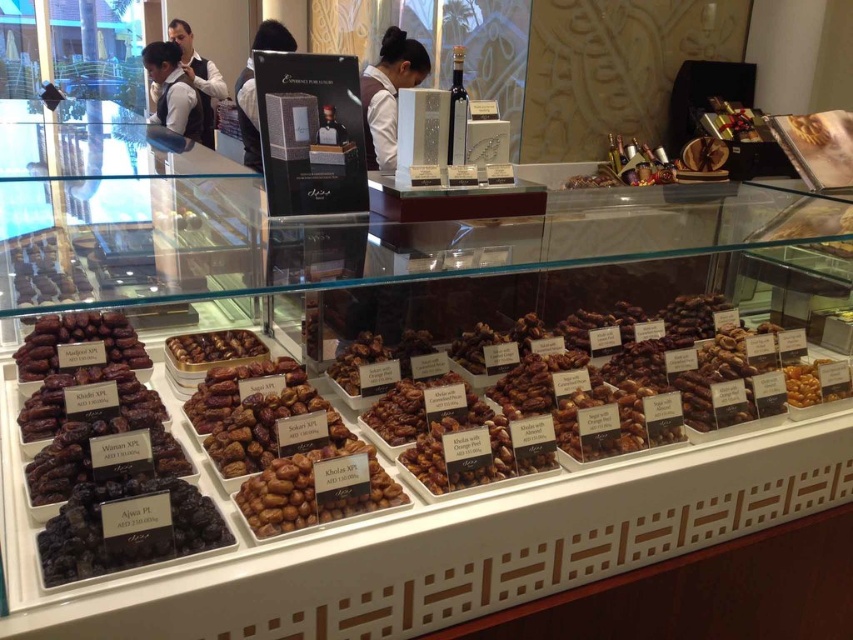
You are a customer in a supermarket looking at the display case. You want to pick up the dark brown dried fruit at lower left but need to avoid touching the white shirt at upper left. Based on their positions, which object is lower and can be reached first?

The dark brown dried fruit at lower left is located below the white shirt at upper left, so you can reach it first without touching the white shirt at upper left.

You are a customer at a store with a display case. You see the matte black uniform at upper center and the brown matte nuts at center. Which one is wider?

The matte black uniform at upper center might be wider than brown matte nuts at center according to the description.

You are a customer looking at the display case of dates and dried fruits. You see a point marked at coordinates (108, 461). Can you tell me what this point is located on?

The point at coordinates (108, 461) is located on the dark brown dried fruit at lower left.